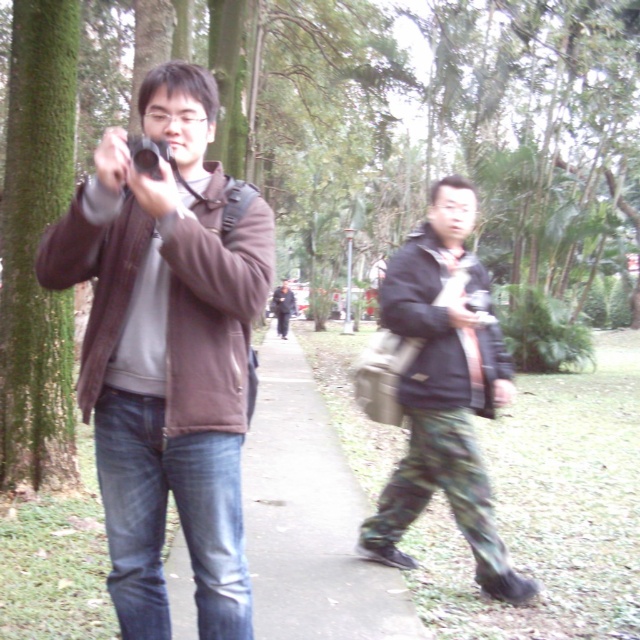
Question: Considering the relative positions of brown matte jacket at center and camouflage pants at center in the image provided, where is brown matte jacket at center located with respect to camouflage pants at center?

Choices:
 (A) below
 (B) above

Answer: (B)

Question: Is concrete sidewalk at center above green rough bark tree at left?

Choices:
 (A) no
 (B) yes

Answer: (A)

Question: Is camouflage pants at center bigger than green rough bark tree at left?

Choices:
 (A) no
 (B) yes

Answer: (A)

Question: Among these points, which one is farthest from the camera?

Choices:
 (A) (70, 401)
 (B) (282, 557)
 (C) (284, 330)

Answer: (C)

Question: Which point is closer to the camera taking this photo?

Choices:
 (A) (257, 442)
 (B) (32, 305)
 (C) (144, 621)
 (D) (280, 330)

Answer: (C)

Question: Estimate the real-world distances between objects in this image. Which object is farther from the camouflage pants at center?

Choices:
 (A) green rough bark tree at left
 (B) concrete sidewalk at center
 (C) brown matte jacket at center
 (D) dark gray jacket at center

Answer: (D)